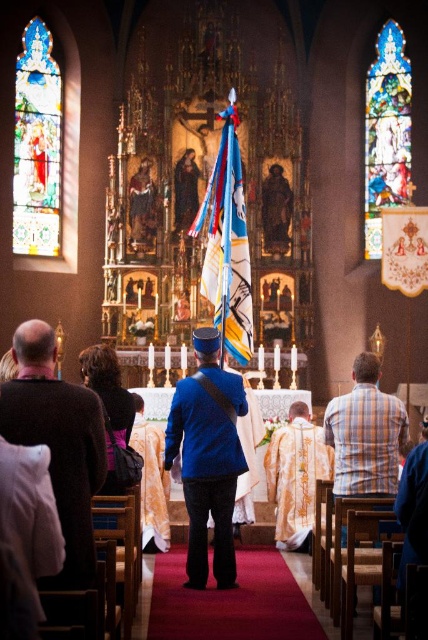
Question: Estimate the real-world distances between objects in this image. Which object is farther from the plaid shirt at center?

Choices:
 (A) blue fabric uniform at center
 (B) dark brown sweater at left
 (C) blue fabric flag at center

Answer: (C)

Question: Where is blue fabric uniform at center located in relation to plaid shirt at center in the image?

Choices:
 (A) left
 (B) right

Answer: (A)

Question: Is dark brown sweater at left in front of blue fabric uniform at center?

Choices:
 (A) no
 (B) yes

Answer: (B)

Question: Which object is farther from the camera taking this photo?

Choices:
 (A) blue fabric flag at center
 (B) blue fabric uniform at center
 (C) plaid shirt at center
 (D) dark brown sweater at left

Answer: (A)

Question: Among these points, which one is nearest to the camera?

Choices:
 (A) (58, 387)
 (B) (186, 460)

Answer: (A)

Question: Is dark brown sweater at left behind plaid shirt at center?

Choices:
 (A) no
 (B) yes

Answer: (A)